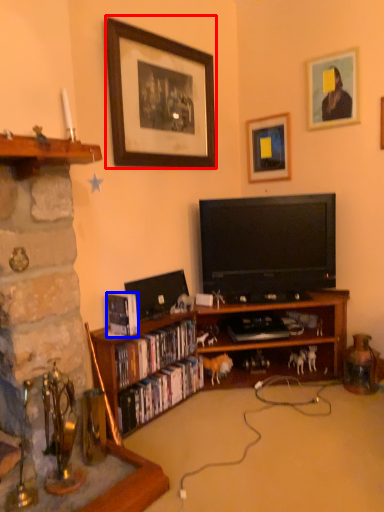
Question: Which object appears farthest to the camera in this image, picture frame (highlighted by a red box) or book (highlighted by a blue box)?

Choices:
 (A) picture frame
 (B) book

Answer: (A)